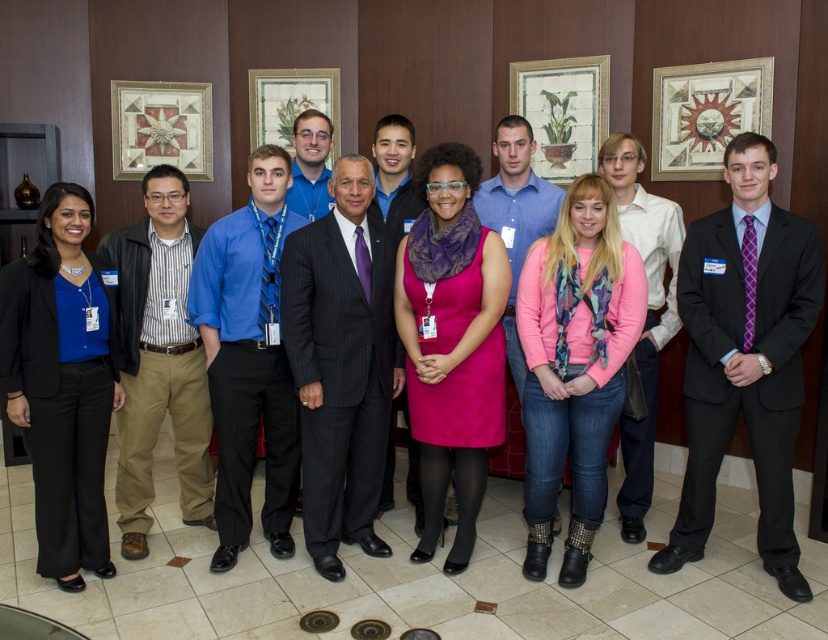
You are organizing a charity event and need to decide which of the two items, the pink soft fabric sweater at center or the matte black suit at center, would be more suitable for a donation bin that requires items to be of average size or larger. Based on the image, which item should you choose?

The pink soft fabric sweater at center has a larger size compared to the matte black suit at center, so it is more suitable for the donation bin requiring items of average size or larger.

You are a photographer who needs to adjust the lighting between the blue shirt at center and the matte wooden picture frame at center. How far apart are these two items?

The blue shirt at center and the matte wooden picture frame at center are 5.95 feet apart from each other.